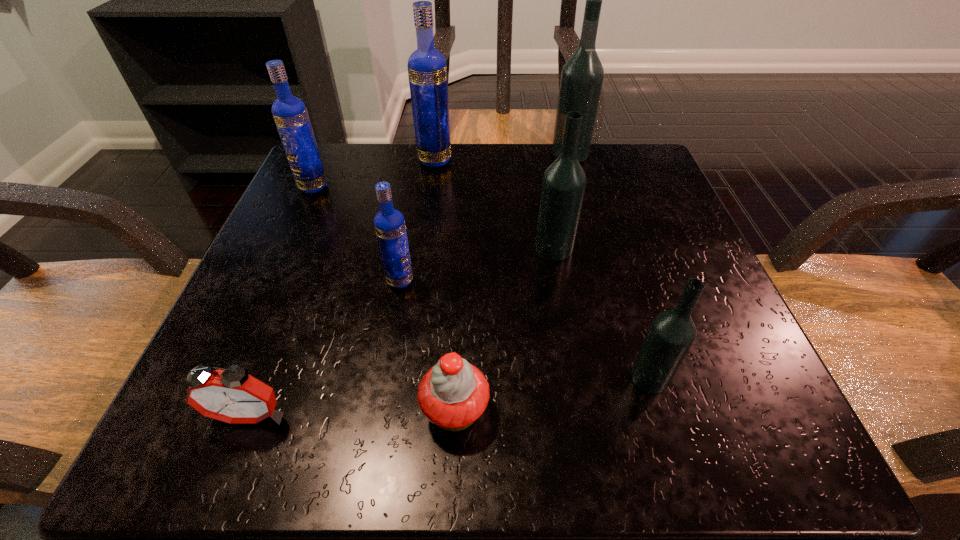
Identify the location of black vodka that stands as the second closest to the nearest black vodka. This screenshot has width=960, height=540. (582, 75).